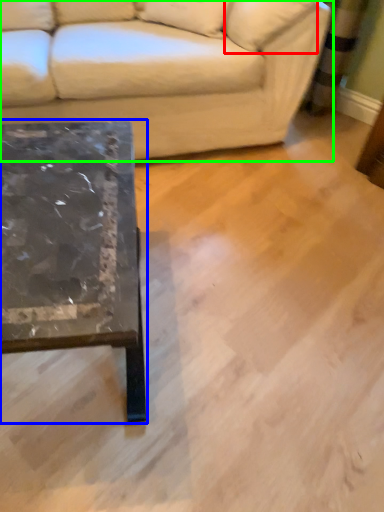
Question: Estimate the real-world distances between objects in this image. Which object is closer to pillow (highlighted by a red box), coffee table (highlighted by a blue box) or studio couch (highlighted by a green box)?

Choices:
 (A) coffee table
 (B) studio couch

Answer: (B)